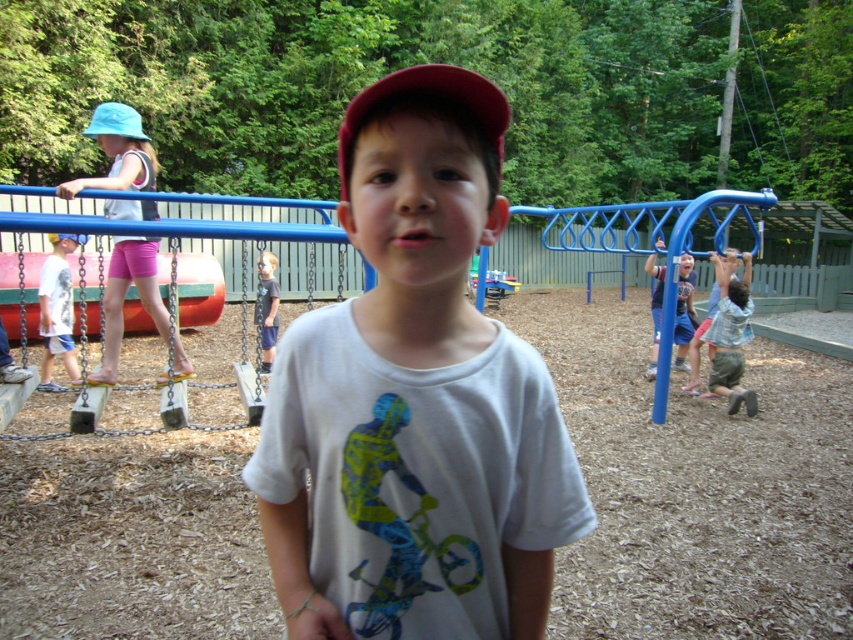
Question: Which of the following is the farthest from the observer?

Choices:
 (A) 688,273
 (B) 410,241
 (C) 117,150

Answer: (A)

Question: Does dark blue shirt at center have a greater width compared to pink matte mouth at center?

Choices:
 (A) no
 (B) yes

Answer: (B)

Question: Based on their relative distances, which object is nearer to the blue fabric baseball hat at upper left?

Choices:
 (A) matte blue shirt at center
 (B) white cotton shirt at center
 (C) blue fabric hat at upper left

Answer: (C)

Question: Which point is farther to the camera?

Choices:
 (A) (57, 189)
 (B) (53, 240)

Answer: (B)

Question: Can you confirm if white cotton shirt at center is positioned to the right of matte blue shirt at center?

Choices:
 (A) no
 (B) yes

Answer: (A)

Question: Can you confirm if white cotton shirt at center is positioned below matte blue shirt at center?

Choices:
 (A) no
 (B) yes

Answer: (B)